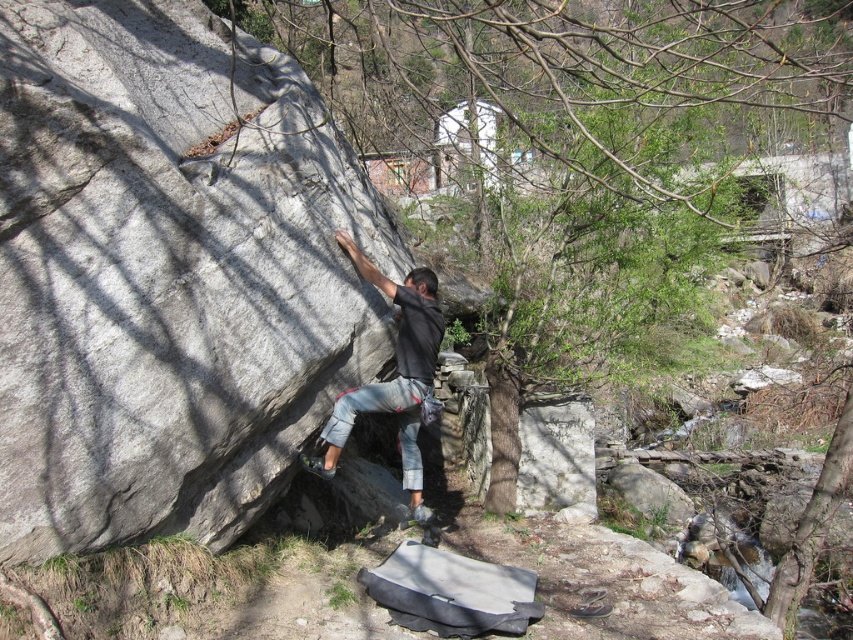
Is gray rough rock at center taller than dark gray stone climbing gear at center?

Indeed, gray rough rock at center has a greater height compared to dark gray stone climbing gear at center.

Does gray rough rock at center have a greater width compared to dark gray stone climbing gear at center?

Yes.

What do you see at coordinates (167, 273) in the screenshot? The image size is (853, 640). I see `gray rough rock at center` at bounding box center [167, 273].

Where is `gray rough rock at center`? gray rough rock at center is located at coordinates (167, 273).